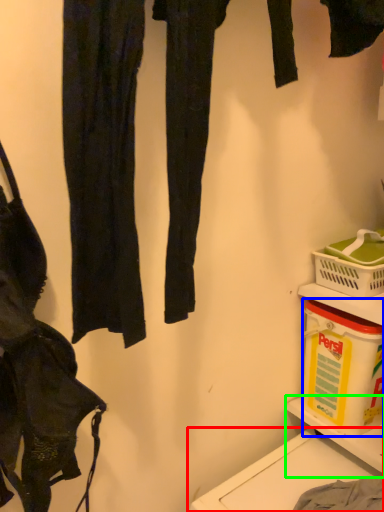
Question: Which is nearer to the washing (highlighted by a red box)? box (highlighted by a blue box) or shelf (highlighted by a green box).

Choices:
 (A) box
 (B) shelf

Answer: (B)